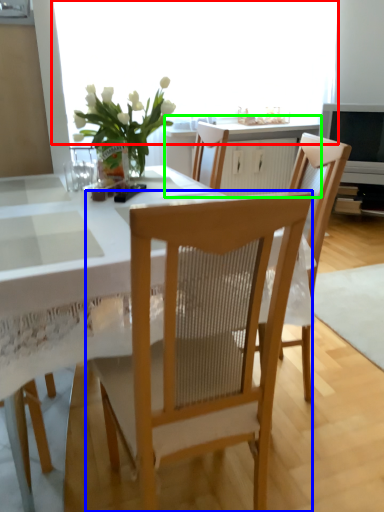
Question: Which object is the closest to the window screen (highlighted by a red box)? Choose among these: chair (highlighted by a blue box) or cabinetry (highlighted by a green box).

Choices:
 (A) chair
 (B) cabinetry

Answer: (B)